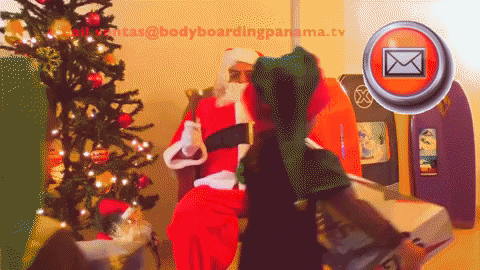
This screenshot has width=480, height=270. I want to click on christmas ornament, so click(23, 241).